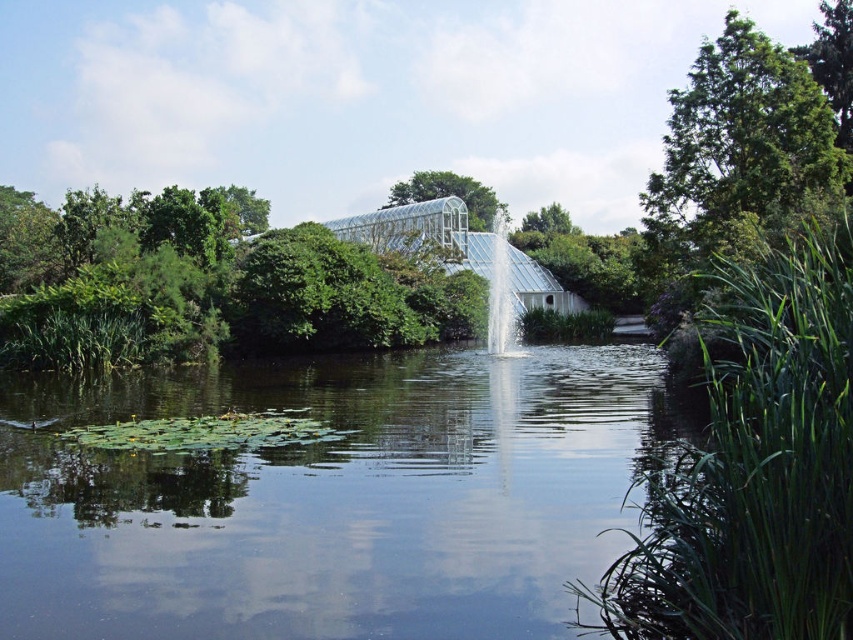
Who is taller, green leafy reeds at right or green glass greenhouse at upper center?

Standing taller between the two is green glass greenhouse at upper center.

Describe the element at coordinates (753, 465) in the screenshot. I see `green leafy reeds at right` at that location.

Is point (759, 515) closer to viewer compared to point (468, 208)?

Yes, it is in front of point (468, 208).

You are a GUI agent. You are given a task and a screenshot of the screen. Output one action in this format:
    pyautogui.click(x=<x>, y=<y>)
    Task: Click on the green leafy reeds at right
    This screenshot has width=853, height=640.
    Given the screenshot: What is the action you would take?
    pyautogui.click(x=753, y=465)

Between point (798, 429) and point (498, 349), which one is positioned behind?

The point (498, 349) is more distant.

Does green leafy reeds at right have a lesser height compared to clear glass waterfall at center?

Yes.

Who is more distant from viewer, (770, 376) or (502, 353)?

Point (502, 353)

Identify the location of green leafy reeds at right. (753, 465).

Who is more forward, (817, 97) or (482, 189)?

Positioned in front is point (817, 97).

Does point (747, 49) come closer to viewer compared to point (395, 204)?

That is True.

Identify the location of green leafy tree at upper right. (741, 148).

Where is `green leafy tree at upper right`? The width and height of the screenshot is (853, 640). green leafy tree at upper right is located at coordinates (741, 148).